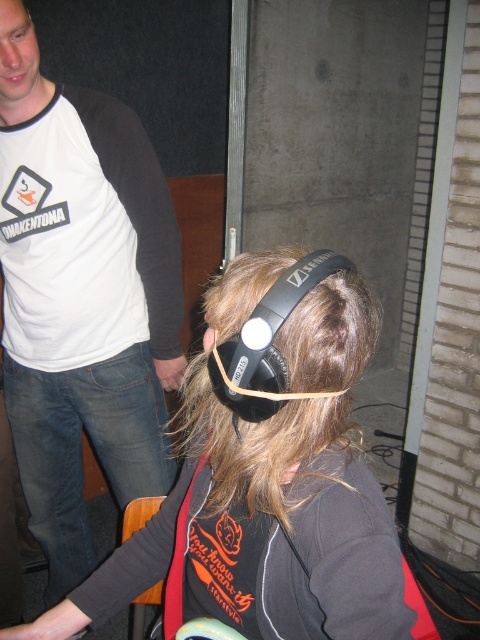
Between point (296, 483) and point (162, 435), which one is positioned in front?

Positioned in front is point (296, 483).

Can you confirm if black matte headphones at center is positioned above white cotton t-shirt at upper left?

No.

Does point (72, 596) come in front of point (74, 140)?

Yes, point (72, 596) is closer to viewer.

Find the location of a particular element. This screenshot has height=640, width=480. black matte headphones at center is located at coordinates (265, 483).

Is white cotton t-shirt at upper left wider than black matte headphones at upper center?

Yes.

Does white cotton t-shirt at upper left appear under black matte headphones at upper center?

Indeed, white cotton t-shirt at upper left is positioned under black matte headphones at upper center.

Between point (56, 92) and point (304, 294), which one is positioned in front?

Positioned in front is point (304, 294).

Image resolution: width=480 pixels, height=640 pixels. I want to click on white cotton t-shirt at upper left, so click(x=82, y=298).

Can you confirm if black matte headphones at center is positioned to the right of black matte headphones at upper center?

Incorrect, black matte headphones at center is not on the right side of black matte headphones at upper center.

Does black matte headphones at center appear over black matte headphones at upper center?

No, black matte headphones at center is not above black matte headphones at upper center.

Is point (243, 432) positioned behind point (264, 378)?

That is True.

Locate an element on the screen. black matte headphones at center is located at coordinates (265, 483).